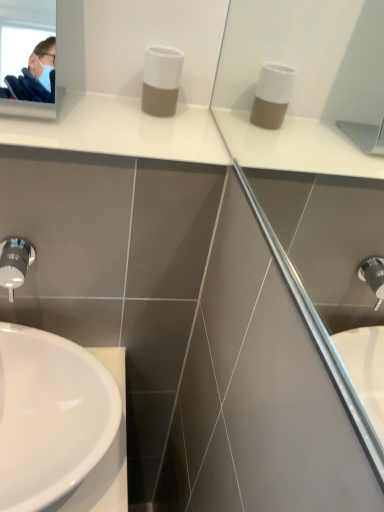
Question: Does white matte soap dispenser at center have a lesser height compared to white glossy sink at lower left?

Choices:
 (A) no
 (B) yes

Answer: (A)

Question: Can you confirm if white matte soap dispenser at center is positioned to the right of white glossy sink at lower left?

Choices:
 (A) no
 (B) yes

Answer: (B)

Question: Is white matte soap dispenser at center closer to the viewer compared to white glossy sink at lower left?

Choices:
 (A) no
 (B) yes

Answer: (A)

Question: Is white matte soap dispenser at center with white glossy sink at lower left?

Choices:
 (A) no
 (B) yes

Answer: (A)

Question: Would you say white glossy sink at lower left is part of white matte soap dispenser at center's contents?

Choices:
 (A) yes
 (B) no

Answer: (B)

Question: Looking at their shapes, would you say white matte soap dispenser at center is wider or thinner than satin nickel faucet at lower left?

Choices:
 (A) thin
 (B) wide

Answer: (B)

Question: In terms of height, does white matte soap dispenser at center look taller or shorter compared to satin nickel faucet at lower left?

Choices:
 (A) tall
 (B) short

Answer: (A)

Question: Is white matte soap dispenser at center in front of or behind satin nickel faucet at lower left in the image?

Choices:
 (A) behind
 (B) front

Answer: (A)

Question: From the image's perspective, is white matte soap dispenser at center positioned above or below satin nickel faucet at lower left?

Choices:
 (A) below
 (B) above

Answer: (B)

Question: Considering the positions of satin nickel faucet at lower left and white matte soap dispenser at center in the image, is satin nickel faucet at lower left wider or thinner than white matte soap dispenser at center?

Choices:
 (A) thin
 (B) wide

Answer: (A)

Question: Considering their positions, is satin nickel faucet at lower left located in front of or behind white matte soap dispenser at center?

Choices:
 (A) behind
 (B) front

Answer: (B)

Question: Is satin nickel faucet at lower left taller or shorter than white matte soap dispenser at center?

Choices:
 (A) tall
 (B) short

Answer: (B)

Question: From a real-world perspective, is satin nickel faucet at lower left positioned above or below white matte soap dispenser at center?

Choices:
 (A) below
 (B) above

Answer: (A)

Question: In terms of height, does white glossy sink at lower left look taller or shorter compared to white matte soap dispenser at center?

Choices:
 (A) short
 (B) tall

Answer: (A)

Question: From a real-world perspective, is white glossy sink at lower left physically located above or below white matte soap dispenser at center?

Choices:
 (A) below
 (B) above

Answer: (A)